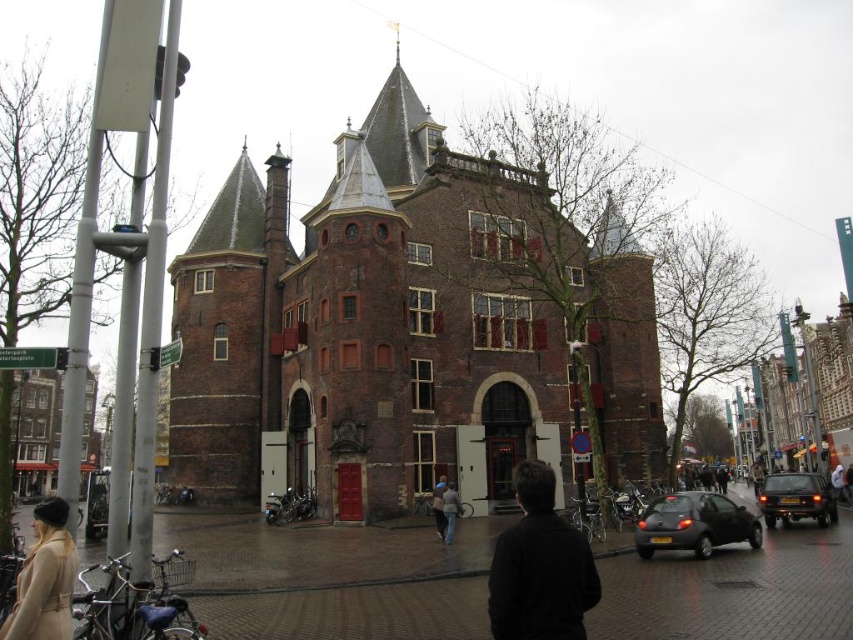
Does black matte jacket at lower center have a lesser height compared to black glossy car at lower right?

Incorrect, black matte jacket at lower center's height does not fall short of black glossy car at lower right's.

Does black matte jacket at lower center have a larger size compared to black glossy car at lower right?

Indeed, black matte jacket at lower center has a larger size compared to black glossy car at lower right.

What do you see at coordinates (540, 566) in the screenshot?
I see `black matte jacket at lower center` at bounding box center [540, 566].

The height and width of the screenshot is (640, 853). I want to click on black matte jacket at lower center, so click(x=540, y=566).

Is black glossy car at lower right thinner than dark brown leather jacket at center?

No, black glossy car at lower right is not thinner than dark brown leather jacket at center.

What do you see at coordinates (796, 499) in the screenshot?
I see `black glossy car at lower right` at bounding box center [796, 499].

Does point (780, 493) lie in front of point (447, 483)?

That is True.

Find the location of `black glossy car at lower right`. black glossy car at lower right is located at coordinates (796, 499).

Is point (648, 518) farther from camera compared to point (840, 472)?

No, it is in front of (840, 472).

Which is more to the left, matte black car at lower right or white hoodie at center?

matte black car at lower right is more to the left.

Identify the location of matte black car at lower right. The height and width of the screenshot is (640, 853). (694, 524).